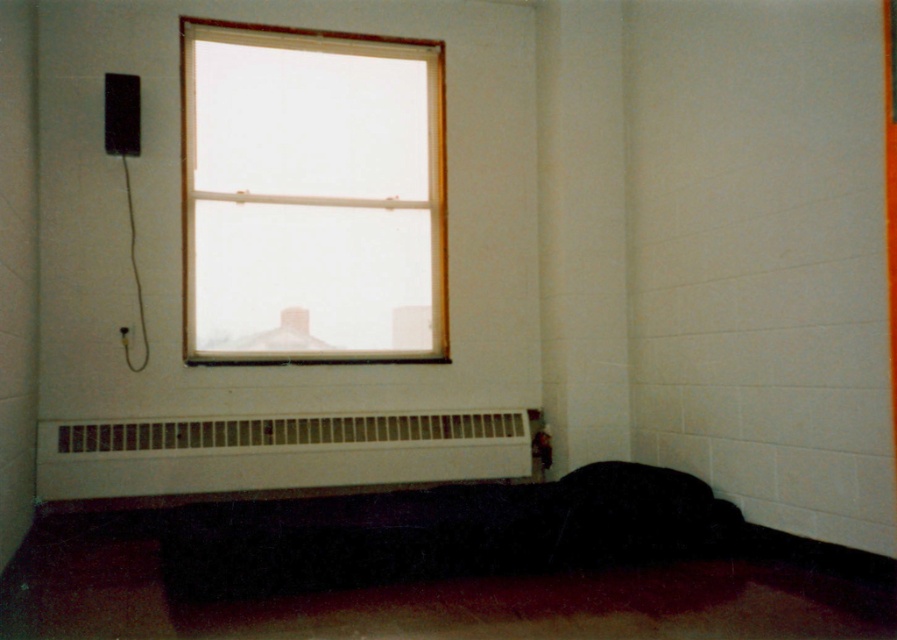
Question: Is clear glass window at upper center positioned behind white matte radiator at lower center?

Choices:
 (A) no
 (B) yes

Answer: (B)

Question: Considering the relative positions of clear glass window at upper center and white matte radiator at lower center in the image provided, where is clear glass window at upper center located with respect to white matte radiator at lower center?

Choices:
 (A) right
 (B) left

Answer: (A)

Question: Is the position of clear glass window at upper center less distant than that of white matte radiator at lower center?

Choices:
 (A) no
 (B) yes

Answer: (A)

Question: Among these points, which one is nearest to the camera?

Choices:
 (A) (460, 424)
 (B) (328, 308)

Answer: (A)